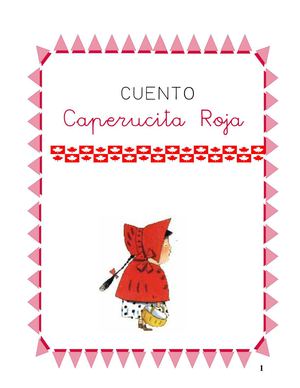
Identify the location of leg. (143, 323).